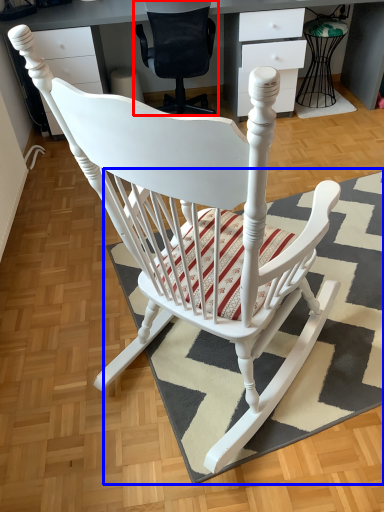
Question: Which object appears closest to the camera in this image, chair (highlighted by a red box) or doormat (highlighted by a blue box)?

Choices:
 (A) chair
 (B) doormat

Answer: (B)